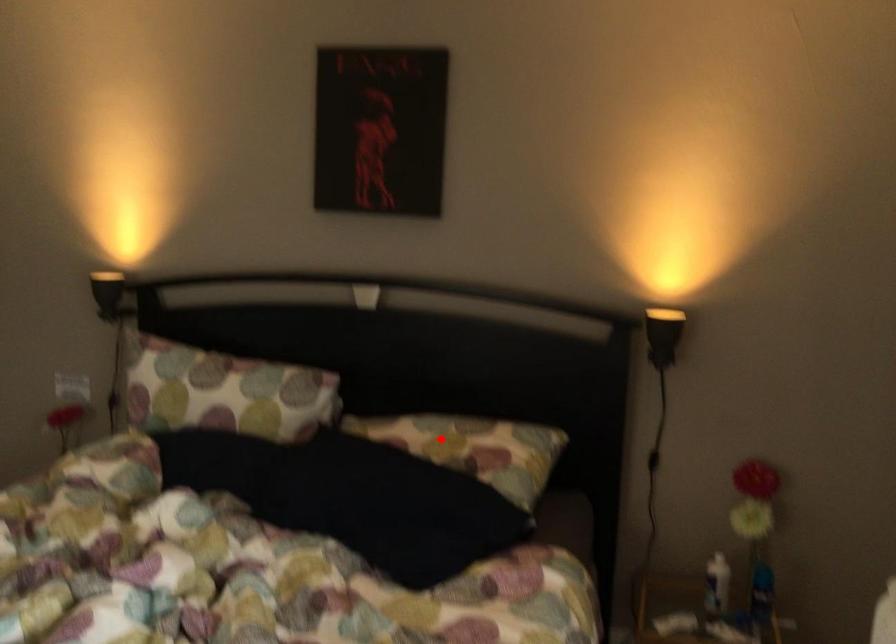
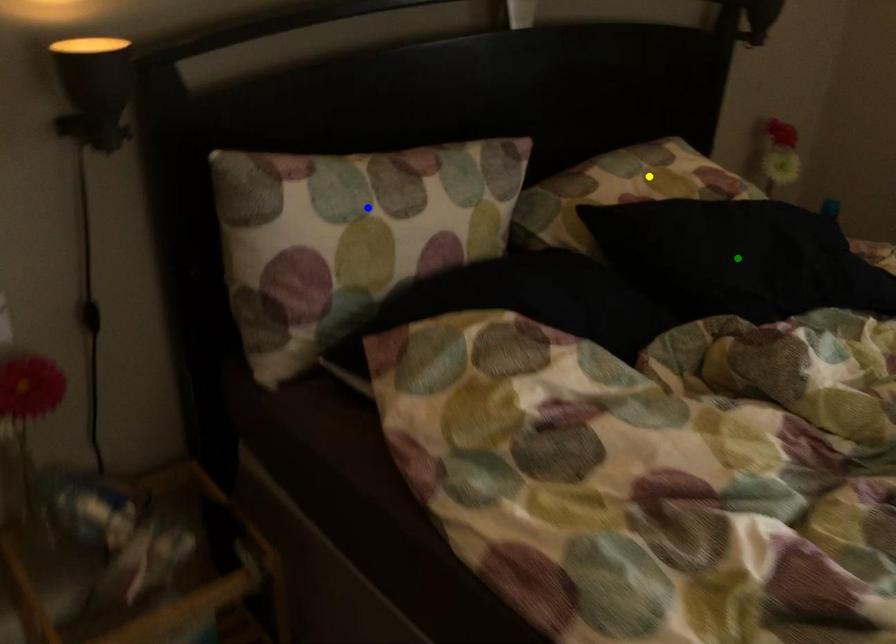
Question: I am providing you with two images of the same scene from different viewpoints. A red point is marked on the first image. You are given multiple points on the second image. Which point in image 2 represents the same 3d spot as the red point in image 1?

Choices:
 (A) green point
 (B) yellow point
 (C) blue point

Answer: (B)